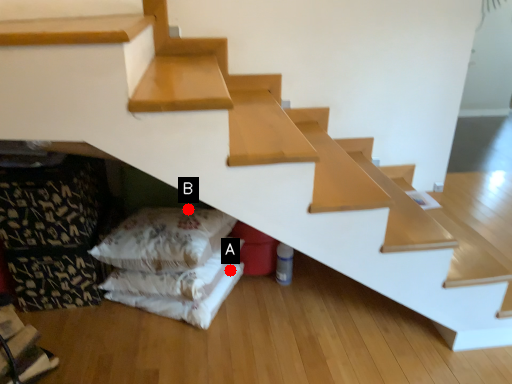
Question: Two points are circled on the image, labeled by A and B beside each circle. Which point is farther from the camera taking this photo?

Choices:
 (A) A is further
 (B) B is further

Answer: (B)